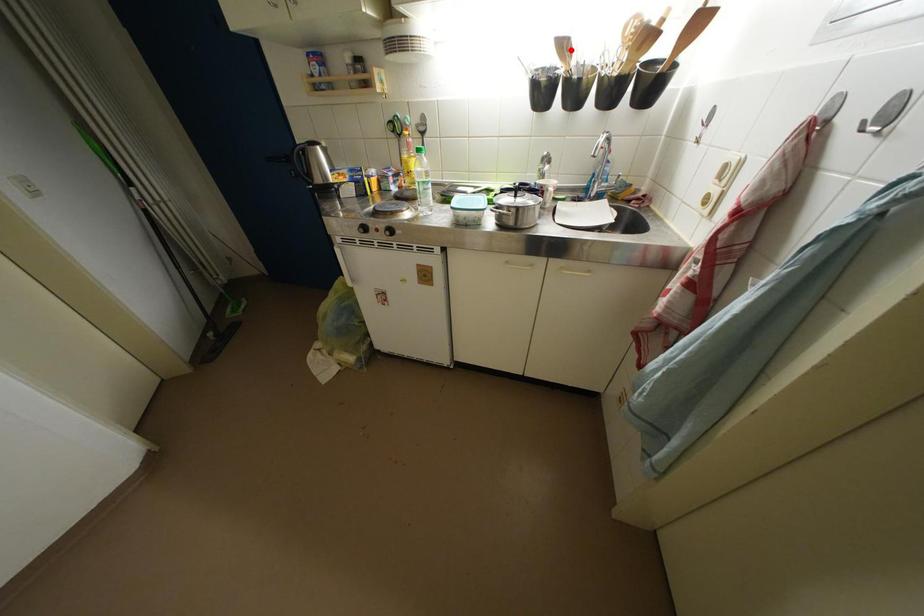
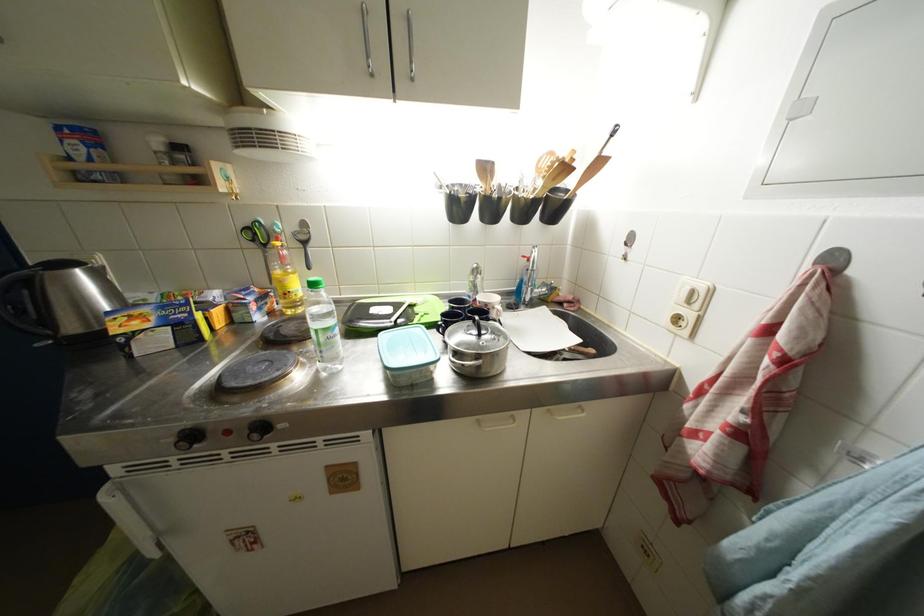
Question: I am providing you with two images of the same scene from different viewpoints. A red point is marked on the first image. Can you still see the location of the red point in image 2?

Choices:
 (A) Yes
 (B) No

Answer: (A)